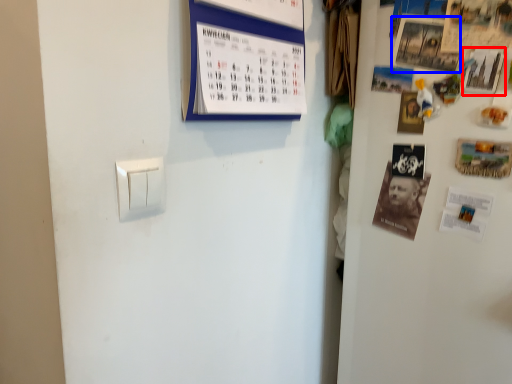
Question: Among these objects, which one is nearest to the camera, poster (highlighted by a red box) or poster (highlighted by a blue box)?

Choices:
 (A) poster
 (B) poster

Answer: (A)